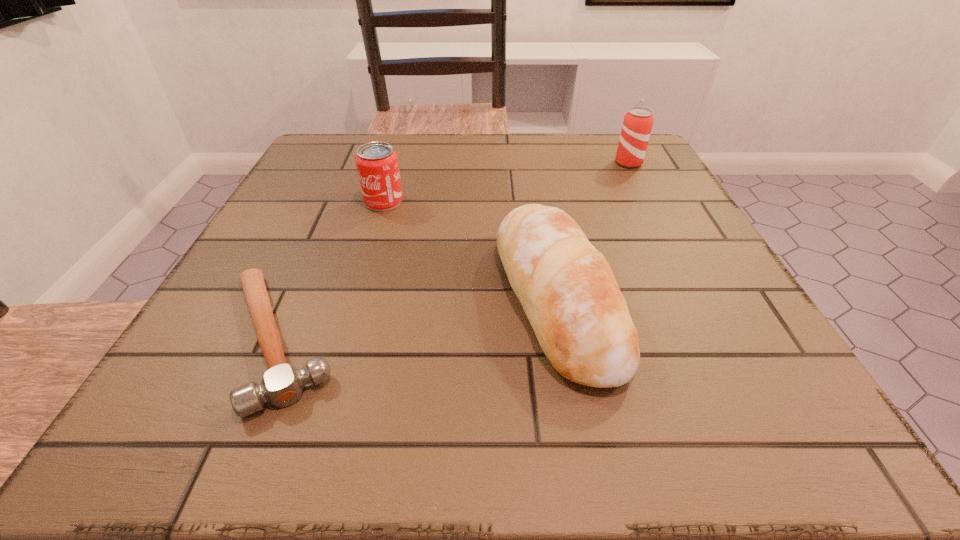
This screenshot has height=540, width=960. I want to click on bread situated at the near edge, so click(567, 289).

Locate an element on the screen. The height and width of the screenshot is (540, 960). hammer situated at the near edge is located at coordinates (282, 384).

The width and height of the screenshot is (960, 540). What are the coordinates of `object positioned at the left edge` in the screenshot? It's located at (282, 384).

Identify the location of object positioned at the right edge. (638, 121).

This screenshot has height=540, width=960. Find the location of `object at the near left corner`. object at the near left corner is located at coordinates (282, 384).

This screenshot has width=960, height=540. I want to click on object that is at the far right corner, so click(638, 121).

Where is `free space at the far edge`? This screenshot has height=540, width=960. free space at the far edge is located at coordinates (546, 160).

The image size is (960, 540). Find the location of `free space at the near edge of the desktop`. free space at the near edge of the desktop is located at coordinates (385, 444).

Image resolution: width=960 pixels, height=540 pixels. In order to click on free spot at the left edge of the desktop in this screenshot , I will do (x=312, y=200).

Locate an element on the screen. vacant space at the right edge of the desktop is located at coordinates (609, 212).